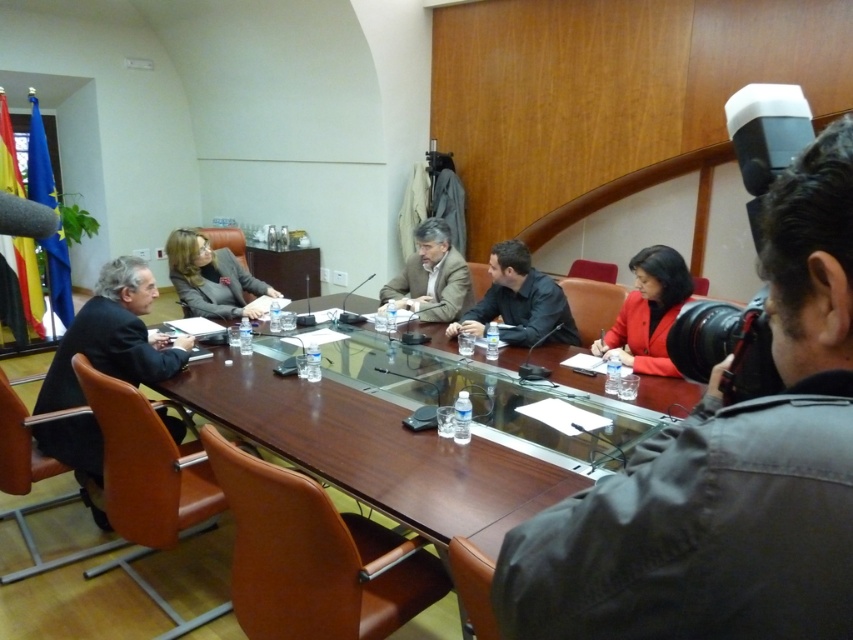
Question: Which object is positioned closest to the matte red blazer at center?

Choices:
 (A) black leather jacket at center
 (B) brown wooden table at center
 (C) matte brown jacket at center
 (D) matte black suit at center

Answer: (A)

Question: Can you confirm if black fabric suit at left is thinner than matte black suit at center?

Choices:
 (A) no
 (B) yes

Answer: (B)

Question: Which object is positioned farthest from the black leather jacket at center?

Choices:
 (A) matte black jacket at lower right
 (B) matte red blazer at center

Answer: (A)

Question: In this image, where is black fabric suit at left located relative to black leather jacket at center?

Choices:
 (A) right
 (B) left

Answer: (B)

Question: Which object is farther from the camera taking this photo?

Choices:
 (A) matte black jacket at lower right
 (B) matte brown jacket at center
 (C) matte red blazer at center

Answer: (B)

Question: Can you confirm if black leather jacket at center is bigger than matte black suit at center?

Choices:
 (A) no
 (B) yes

Answer: (A)